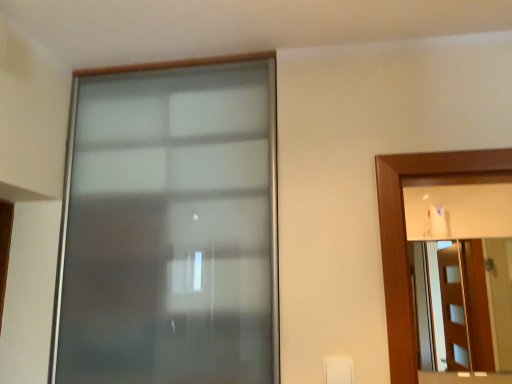
Question: Would you say frosted glass window at center is inside or outside frosted glass mirror at right?

Choices:
 (A) outside
 (B) inside

Answer: (A)

Question: Is point [x=139, y=69] positioned closer to the camera than point [x=496, y=357]?

Choices:
 (A) closer
 (B) farther

Answer: (A)

Question: In terms of width, does frosted glass window at center look wider or thinner when compared to frosted glass mirror at right?

Choices:
 (A) wide
 (B) thin

Answer: (B)

Question: In terms of size, does frosted glass mirror at right appear bigger or smaller than frosted glass window at center?

Choices:
 (A) small
 (B) big

Answer: (A)

Question: Considering the relative positions of frosted glass mirror at right and frosted glass window at center in the image provided, is frosted glass mirror at right to the left or to the right of frosted glass window at center?

Choices:
 (A) right
 (B) left

Answer: (A)

Question: Is frosted glass mirror at right situated inside frosted glass window at center or outside?

Choices:
 (A) inside
 (B) outside

Answer: (B)

Question: Relative to frosted glass window at center, is frosted glass mirror at right in front or behind?

Choices:
 (A) front
 (B) behind

Answer: (B)